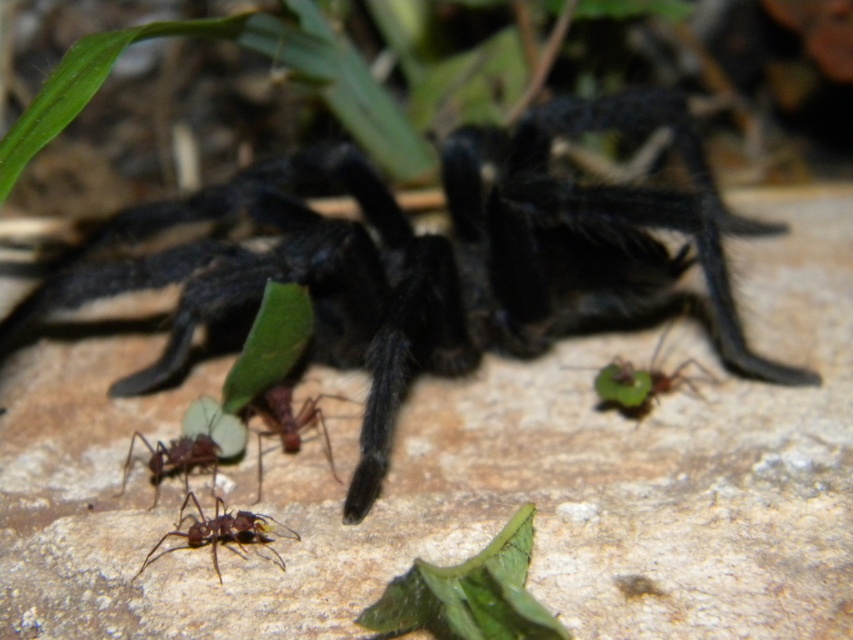
Is brown matte ant at lower left wider than brown matte ant at lower center?

In fact, brown matte ant at lower left might be narrower than brown matte ant at lower center.

Between brown matte ant at lower left and brown matte ant at lower center, which one appears on the left side from the viewer's perspective?

From the viewer's perspective, brown matte ant at lower left appears more on the left side.

At what (x,y) coordinates should I click in order to perform the action: click on brown matte ant at lower left. Please return your answer as a coordinate pair (x, y). The image size is (853, 640). Looking at the image, I should click on (192, 444).

Is brown matte ant at lower center bigger than brown matte ant at center?

No, brown matte ant at lower center is not bigger than brown matte ant at center.

Who is lower down, brown matte ant at lower center or brown matte ant at center?

brown matte ant at lower center

Describe the element at coordinates (223, 531) in the screenshot. I see `brown matte ant at lower center` at that location.

The height and width of the screenshot is (640, 853). Find the location of `brown matte ant at lower center`. brown matte ant at lower center is located at coordinates (223, 531).

Can you confirm if green leafy plant at upper center is positioned to the right of brown matte ant at lower center?

In fact, green leafy plant at upper center is to the left of brown matte ant at lower center.

Is green leafy plant at upper center in front of brown matte ant at lower center?

That is True.

Between point (270, 40) and point (265, 524), which one is positioned behind?

The point (270, 40) is behind.

You are a GUI agent. You are given a task and a screenshot of the screen. Output one action in this format:
    pyautogui.click(x=<x>, y=<y>)
    Task: Click on the green leafy plant at upper center
    
    Given the screenshot: What is the action you would take?
    pyautogui.click(x=115, y=58)